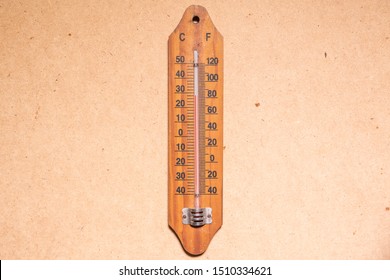
At what (x,y) coordinates should I click in order to perform the action: click on grain of wood. Please return your answer as a coordinate pair (x, y). Looking at the image, I should click on (182, 47), (176, 45), (187, 45), (193, 42).